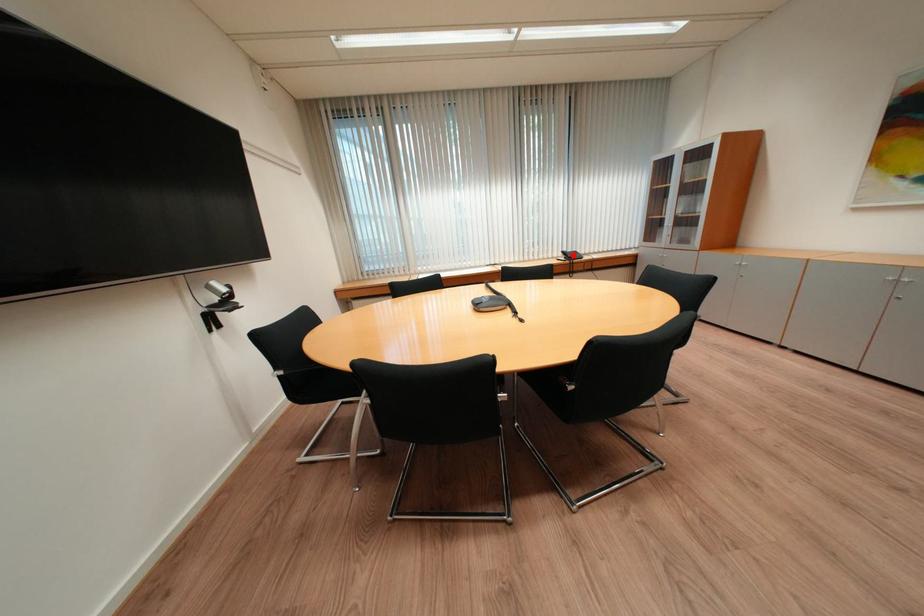
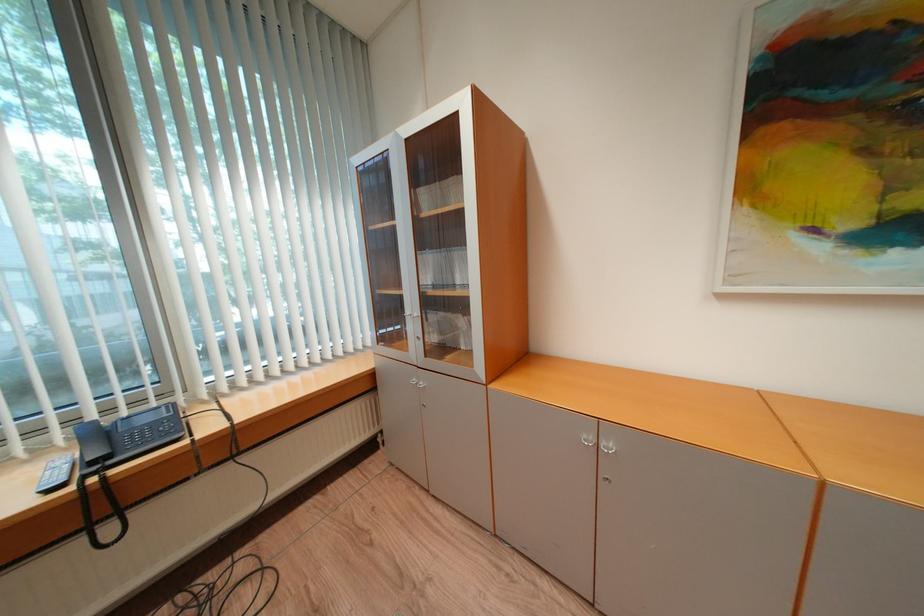
Question: I am providing you with two images of the same scene from different viewpoints. Image1 has a red point marked. In image2, the corresponding 3D location appears at what relative position? Reply with the corresponding letter.

Choices:
 (A) Closer
 (B) Farther

Answer: (A)